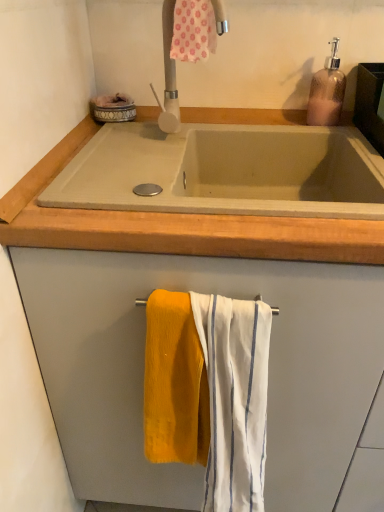
Question: Is pink floral fabric at upper center, marked as the 3th bath towel in a bottom-to-top arrangement, positioned behind concrete sink at center?

Choices:
 (A) yes
 (B) no

Answer: (A)

Question: Does pink floral fabric at upper center, which ranks as the first bath towel in top-to-bottom order, have a lesser width compared to concrete sink at center?

Choices:
 (A) yes
 (B) no

Answer: (A)

Question: From the image's perspective, would you say pink floral fabric at upper center, which ranks as the first bath towel in top-to-bottom order, is shown under concrete sink at center?

Choices:
 (A) no
 (B) yes

Answer: (A)

Question: Considering the relative sizes of pink floral fabric at upper center, marked as the 3th bath towel in a bottom-to-top arrangement, and concrete sink at center in the image provided, is pink floral fabric at upper center, marked as the 3th bath towel in a bottom-to-top arrangement, taller than concrete sink at center?

Choices:
 (A) yes
 (B) no

Answer: (B)

Question: From a real-world perspective, is pink floral fabric at upper center, which ranks as the first bath towel in top-to-bottom order, below concrete sink at center?

Choices:
 (A) yes
 (B) no

Answer: (B)

Question: Would you say pink floral fabric at upper center, which ranks as the first bath towel in top-to-bottom order, is to the left or to the right of soft yellow towel at lower center, acting as the second bath towel starting from the top, in the picture?

Choices:
 (A) right
 (B) left

Answer: (A)

Question: Is point (210, 16) positioned closer to the camera than point (145, 411)?

Choices:
 (A) farther
 (B) closer

Answer: (A)

Question: Is pink floral fabric at upper center, which ranks as the first bath towel in top-to-bottom order, inside the boundaries of soft yellow towel at lower center, arranged as the second bath towel when ordered from the bottom, or outside?

Choices:
 (A) outside
 (B) inside

Answer: (A)

Question: Is pink floral fabric at upper center, marked as the 3th bath towel in a bottom-to-top arrangement, in front of or behind soft yellow towel at lower center, arranged as the second bath towel when ordered from the bottom, in the image?

Choices:
 (A) behind
 (B) front

Answer: (A)

Question: From a real-world perspective, is white striped fabric at center, placed as the 1th bath towel when sorted from bottom to top, positioned above or below white matte tap at upper center?

Choices:
 (A) below
 (B) above

Answer: (A)

Question: Considering the positions of white striped fabric at center, the 3th bath towel positioned from the top, and white matte tap at upper center in the image, is white striped fabric at center, the 3th bath towel positioned from the top, bigger or smaller than white matte tap at upper center?

Choices:
 (A) big
 (B) small

Answer: (A)

Question: Visually, is white striped fabric at center, the 3th bath towel positioned from the top, positioned to the left or to the right of white matte tap at upper center?

Choices:
 (A) right
 (B) left

Answer: (A)

Question: In terms of width, does white striped fabric at center, the 3th bath towel positioned from the top, look wider or thinner when compared to white matte tap at upper center?

Choices:
 (A) wide
 (B) thin

Answer: (B)

Question: In terms of height, does soft yellow towel at lower center, acting as the second bath towel starting from the top, look taller or shorter compared to translucent brown soap dispenser at upper right?

Choices:
 (A) short
 (B) tall

Answer: (B)

Question: From the image's perspective, is soft yellow towel at lower center, acting as the second bath towel starting from the top, located above or below translucent brown soap dispenser at upper right?

Choices:
 (A) above
 (B) below

Answer: (B)